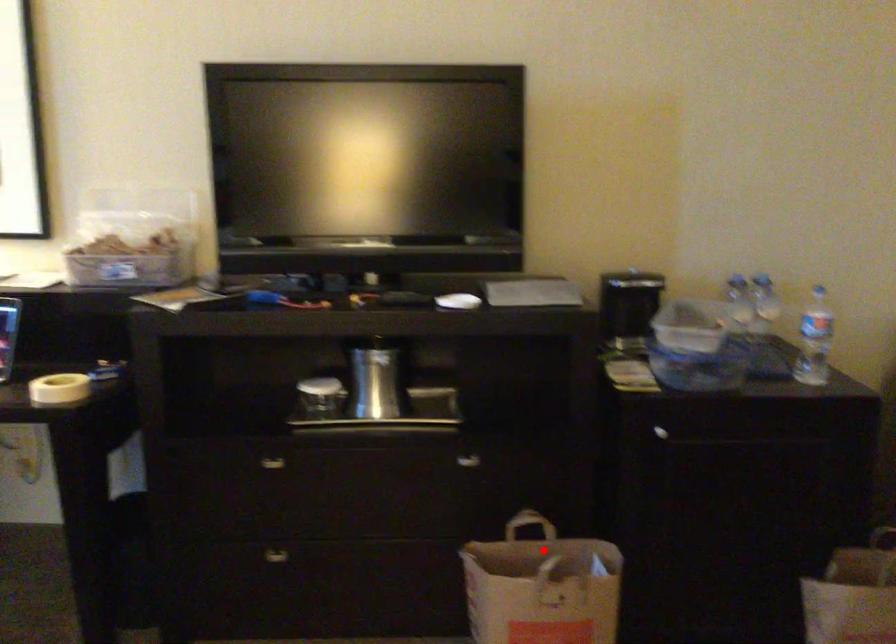
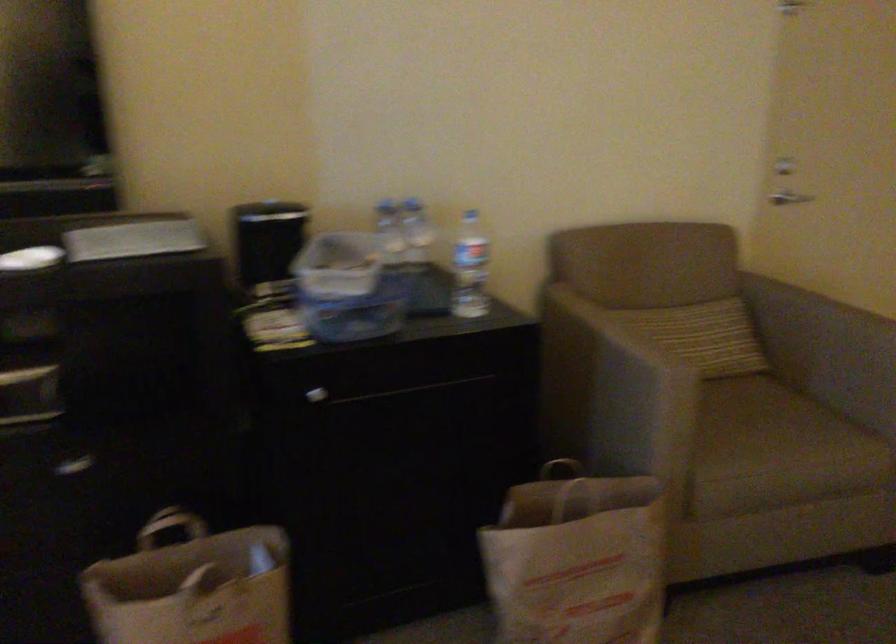
Question: I am providing you with two images of the same scene from different viewpoints. Given a red point in image1, look at the same physical point in image2. Is it:

Choices:
 (A) Closer to the viewpoint
 (B) Farther from the viewpoint

Answer: (A)